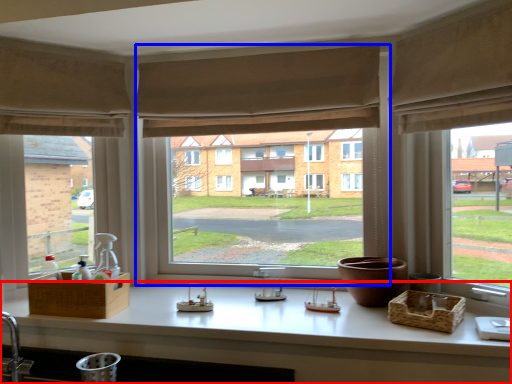
Question: Among these objects, which one is farthest to the camera, counter top (highlighted by a red box) or window (highlighted by a blue box)?

Choices:
 (A) counter top
 (B) window

Answer: (B)